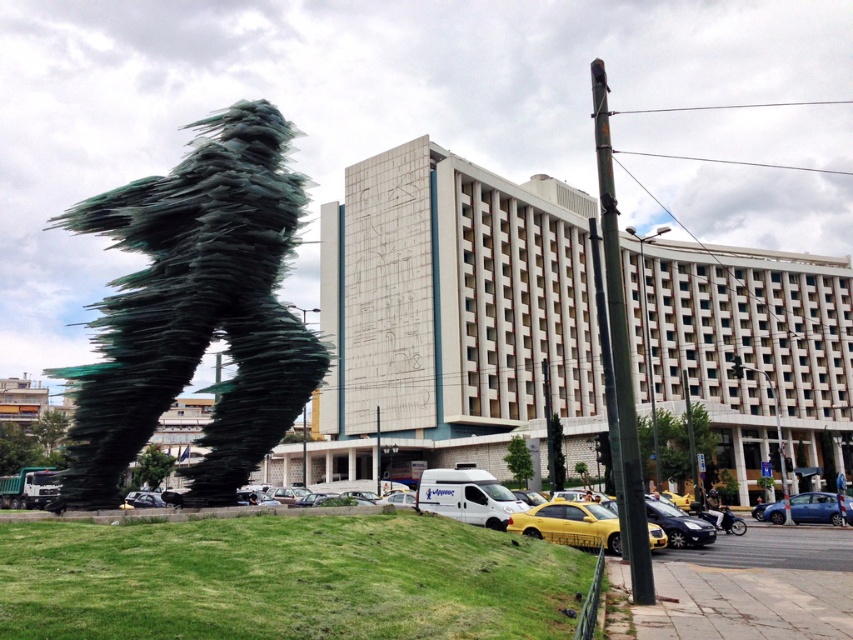
Image resolution: width=853 pixels, height=640 pixels. What do you see at coordinates (195, 308) in the screenshot? I see `green glass sculpture at left` at bounding box center [195, 308].

This screenshot has height=640, width=853. What do you see at coordinates (195, 308) in the screenshot?
I see `green glass sculpture at left` at bounding box center [195, 308].

The height and width of the screenshot is (640, 853). Identify the location of green glass sculpture at left. (195, 308).

Does blue metallic car at lower right have a larger size compared to metallic silver car at lower left?

Indeed, blue metallic car at lower right has a larger size compared to metallic silver car at lower left.

Can you confirm if blue metallic car at lower right is thinner than metallic silver car at lower left?

In fact, blue metallic car at lower right might be wider than metallic silver car at lower left.

Is point (815, 515) more distant than point (157, 506)?

No, (815, 515) is closer to viewer.

The width and height of the screenshot is (853, 640). Find the location of `blue metallic car at lower right`. blue metallic car at lower right is located at coordinates (814, 508).

The width and height of the screenshot is (853, 640). Describe the element at coordinates (195, 308) in the screenshot. I see `green glass sculpture at left` at that location.

Does point (229, 300) come closer to viewer compared to point (595, 90)?

That is False.

In order to click on green glass sculpture at left in this screenshot , I will do `click(195, 308)`.